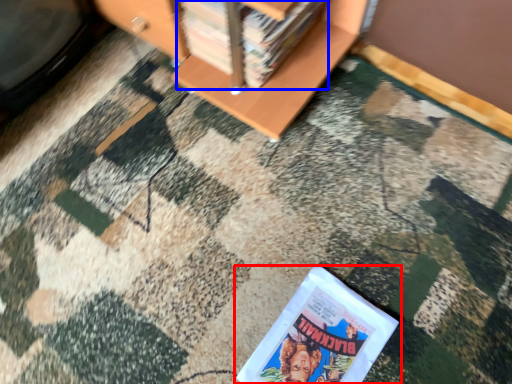
Question: Which of the following is the closest to the observer, book (highlighted by a red box) or book (highlighted by a blue box)?

Choices:
 (A) book
 (B) book

Answer: (A)